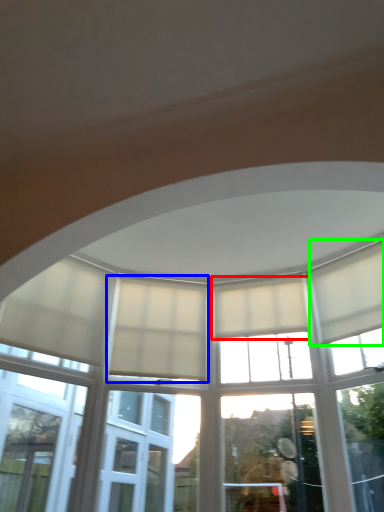
Question: Which object is positioned closest to curtain (highlighted by a red box)? Select from curtain (highlighted by a blue box) and curtain (highlighted by a green box).

Choices:
 (A) curtain
 (B) curtain

Answer: (B)